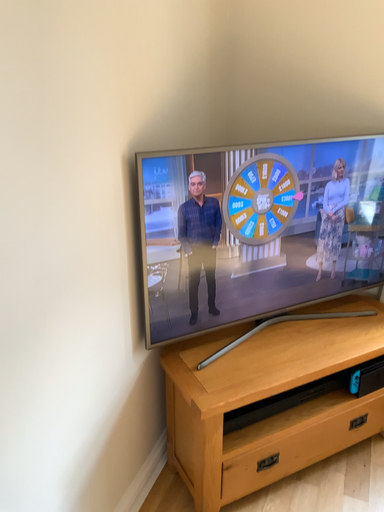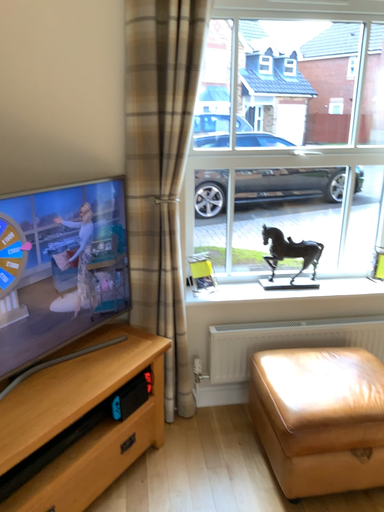
Question: Which way did the camera rotate in the video?

Choices:
 (A) rotated upward
 (B) rotated downward

Answer: (A)